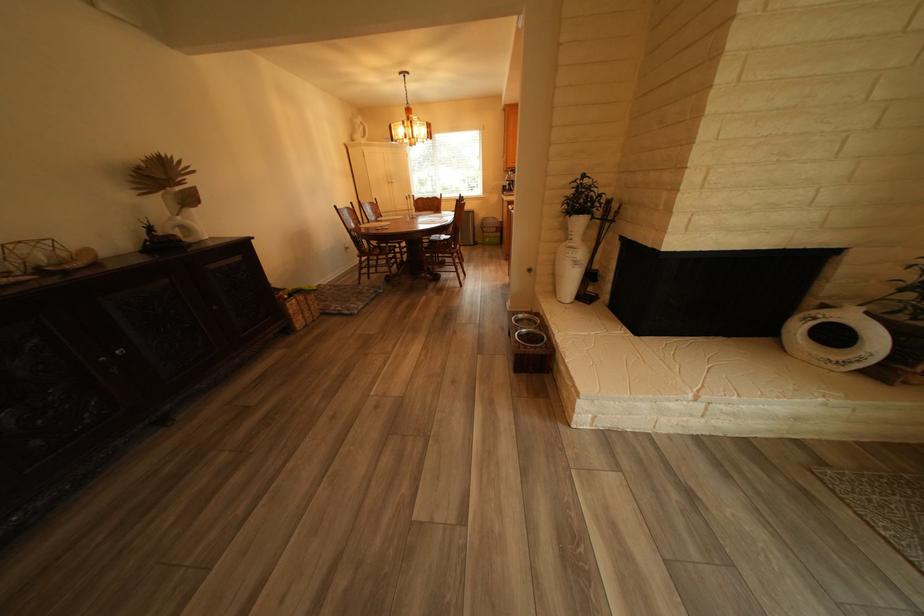
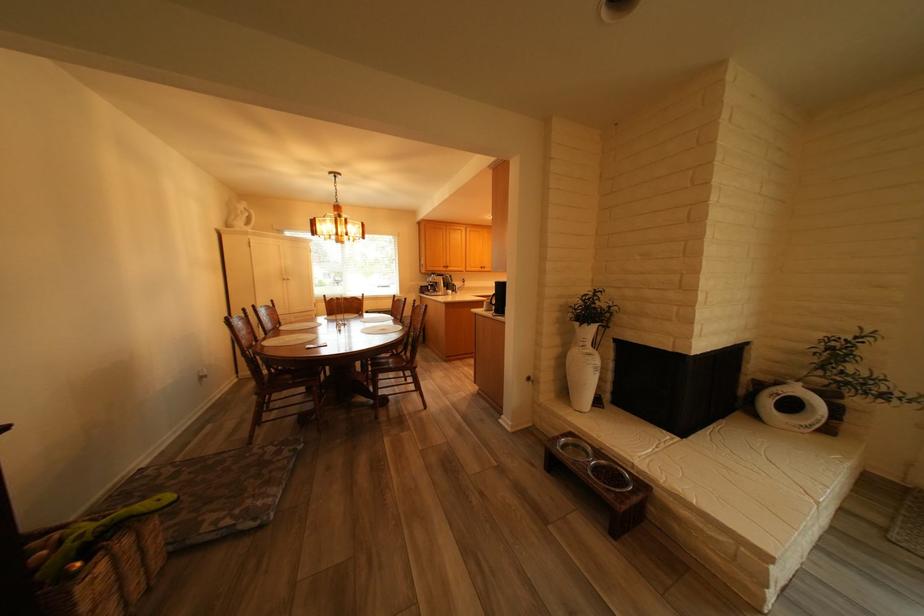
Locate, in the second image, the point that corresponds to pixel 542 321 in the first image.

(590, 447)